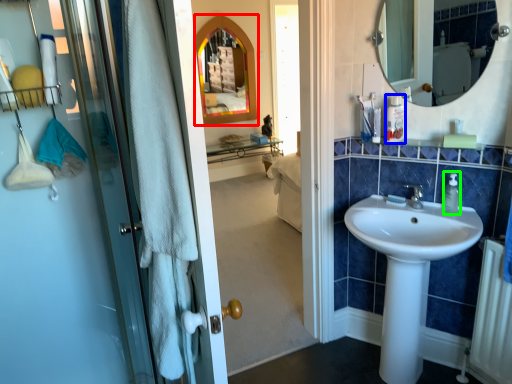
Question: Which object is the farthest from medicine cabinet (highlighted by a red box)? Choose among these: toiletry (highlighted by a blue box) or soap dispenser (highlighted by a green box).

Choices:
 (A) toiletry
 (B) soap dispenser

Answer: (B)